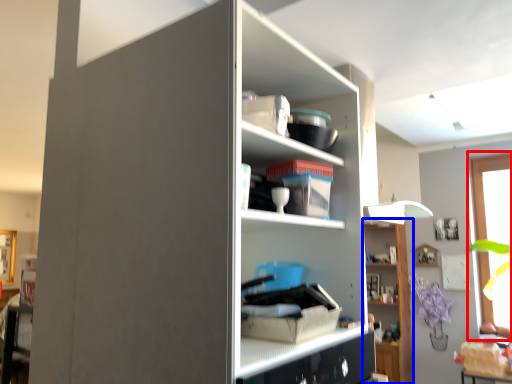
Question: Which of the following is the farthest to the observer, window (highlighted by a red box) or shelf (highlighted by a blue box)?

Choices:
 (A) window
 (B) shelf

Answer: (B)